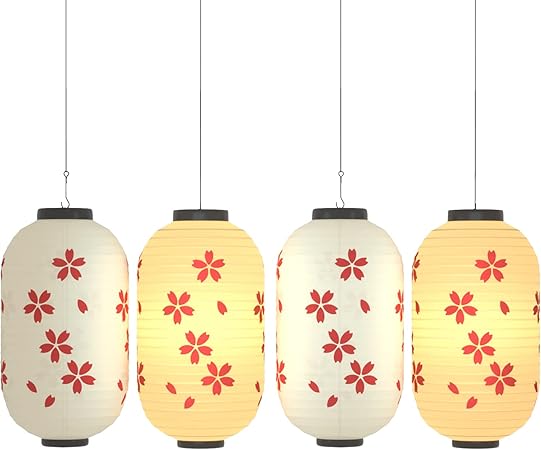
Find the location of `paper lantern`. paper lantern is located at coordinates (89, 345), (229, 408), (349, 404), (494, 391).